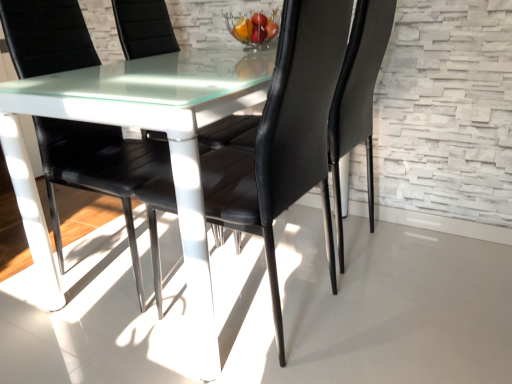
You are a GUI agent. You are given a task and a screenshot of the screen. Output one action in this format:
    pyautogui.click(x=<x>, y=<y>)
    Task: Click on the free point to the right of black leather chair at center, the first chair viewed from the right
    The height and width of the screenshot is (384, 512).
    Given the screenshot: What is the action you would take?
    (419, 252)